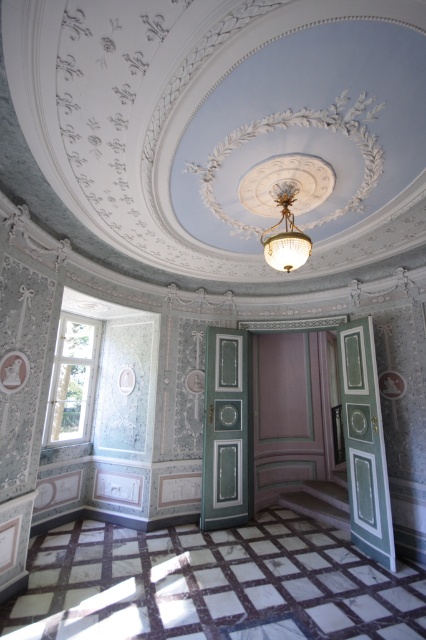
Does green glossy door at center appear on the right side of gold crystal chandelier at center?

Incorrect, green glossy door at center is not on the right side of gold crystal chandelier at center.

Which is more to the left, green glossy door at center or gold crystal chandelier at center?

green glossy door at center is more to the left.

Locate an element on the screen. green glossy door at center is located at coordinates (224, 429).

Looking at this image, between green painted wood door at right and gold crystal chandelier at center, which one appears on the left side from the viewer's perspective?

From the viewer's perspective, gold crystal chandelier at center appears more on the left side.

Between green painted wood door at right and gold crystal chandelier at center, which one has less height?

gold crystal chandelier at center

The image size is (426, 640). In order to click on green painted wood door at right in this screenshot , I will do `click(365, 444)`.

Does green painted wood door at right have a smaller size compared to green glossy door at center?

Yes.

Does point (363, 429) come behind point (224, 509)?

No, (363, 429) is in front of (224, 509).

Which is in front, point (371, 416) or point (233, 397)?

Point (371, 416)

This screenshot has height=640, width=426. Find the location of `green painted wood door at right`. green painted wood door at right is located at coordinates (365, 444).